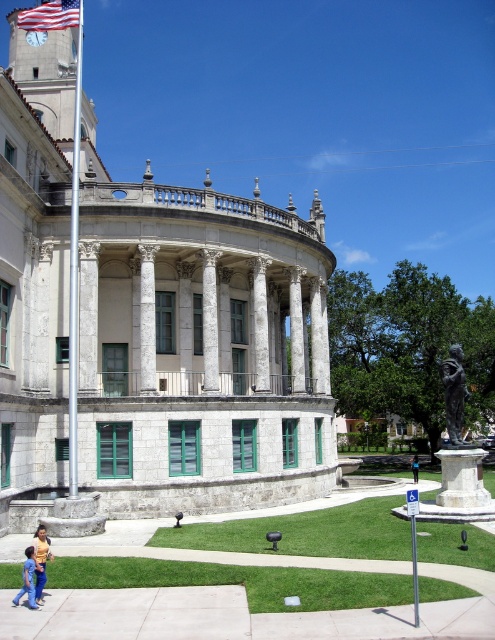
You are a photographer planning to take a picture of the grand classical building. You want to ensure both the white marble column at center and the american flag at upper left are visible in the frame. Based on their sizes, which object should you focus on to include both in the composition?

The white marble column at center is taller than the american flag at upper left. To include both in the composition, focus on the white marble column at center as it is the larger object, ensuring the american flag at upper left will also fit within the frame.

You are standing at the entrance of the grand classical building. You want to walk directly towards the bronze statue at center. Which direction should you head, left or right?

The bronze statue at center is located at point coordinates that are to the right of the entrance, so you should head right to reach it.